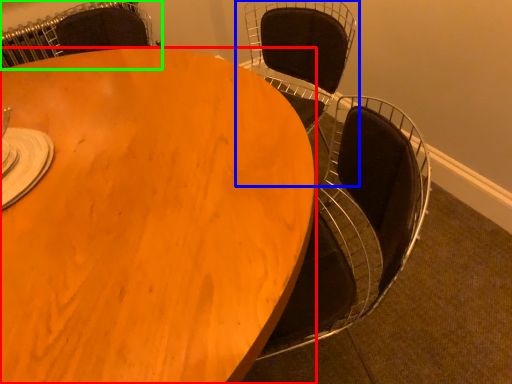
Question: Estimate the real-world distances between objects in this image. Which object is farther from table (highlighted by a red box), chair (highlighted by a blue box) or chair (highlighted by a green box)?

Choices:
 (A) chair
 (B) chair

Answer: (B)